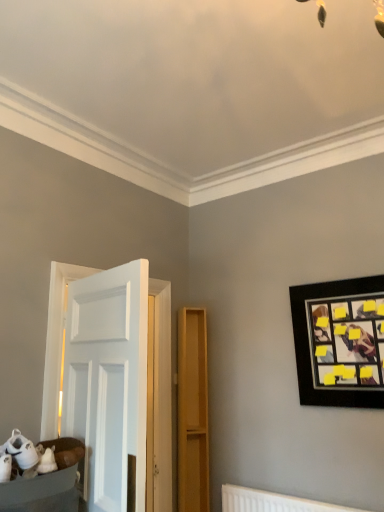
Question: Considering the positions of white fabric basket at lower left and black matte picture frame at upper right in the image, is white fabric basket at lower left wider or thinner than black matte picture frame at upper right?

Choices:
 (A) thin
 (B) wide

Answer: (B)

Question: From the image's perspective, relative to black matte picture frame at upper right, is white fabric basket at lower left above or below?

Choices:
 (A) above
 (B) below

Answer: (B)

Question: Which object is positioned closest to the matte wood dresser at center?

Choices:
 (A) black matte picture frame at upper right
 (B) white fabric basket at lower left
 (C) white plastic radiator at lower center

Answer: (C)

Question: Considering the real-world distances, which object is farthest from the black matte picture frame at upper right?

Choices:
 (A) matte wood dresser at center
 (B) white fabric basket at lower left
 (C) white plastic radiator at lower center

Answer: (B)